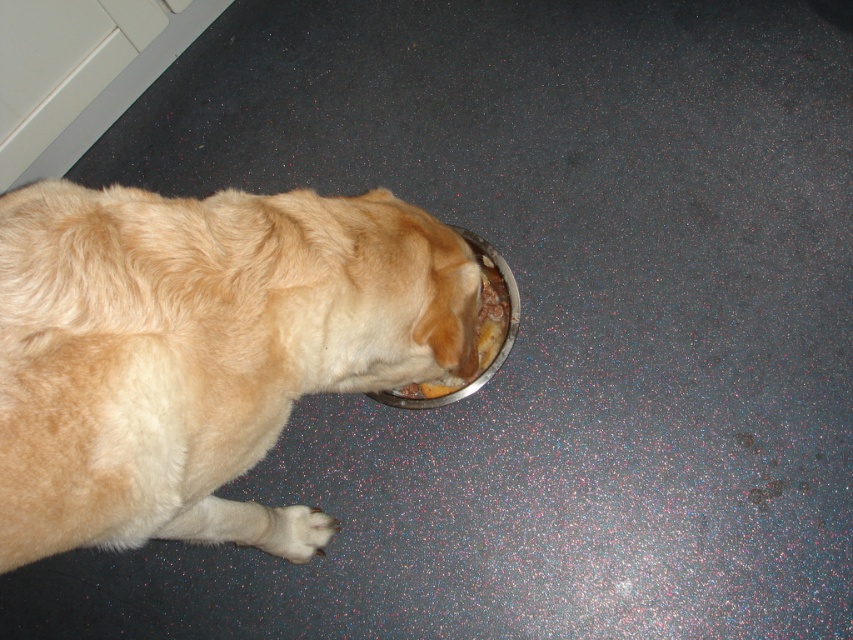
You are a dog trainer observing the golden fur dog at lower left and the white fur paw at lower left. Which one has a larger width?

The golden fur dog at lower left might be wider than white fur paw at lower left.

You are a dog trainer observing the golden fur dog at lower left and the metallic silver bowl at lower center. Which object is taller?

The golden fur dog at lower left is taller than the metallic silver bowl at lower center.